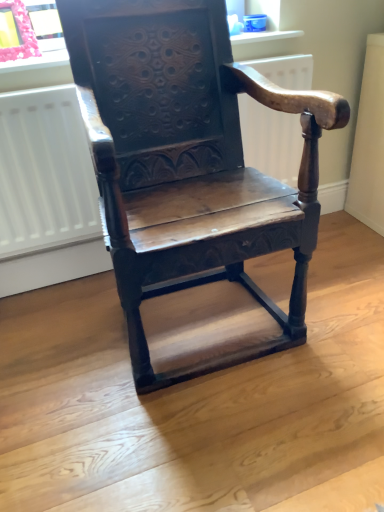
This screenshot has height=512, width=384. In order to click on free point below wooden carved chair at center (from a real-world perspective) in this screenshot , I will do point(203,314).